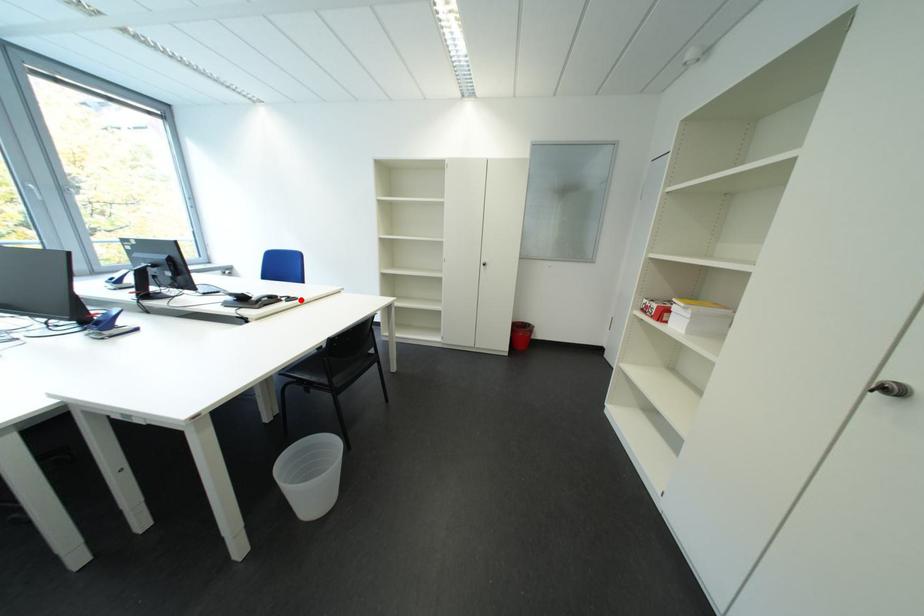
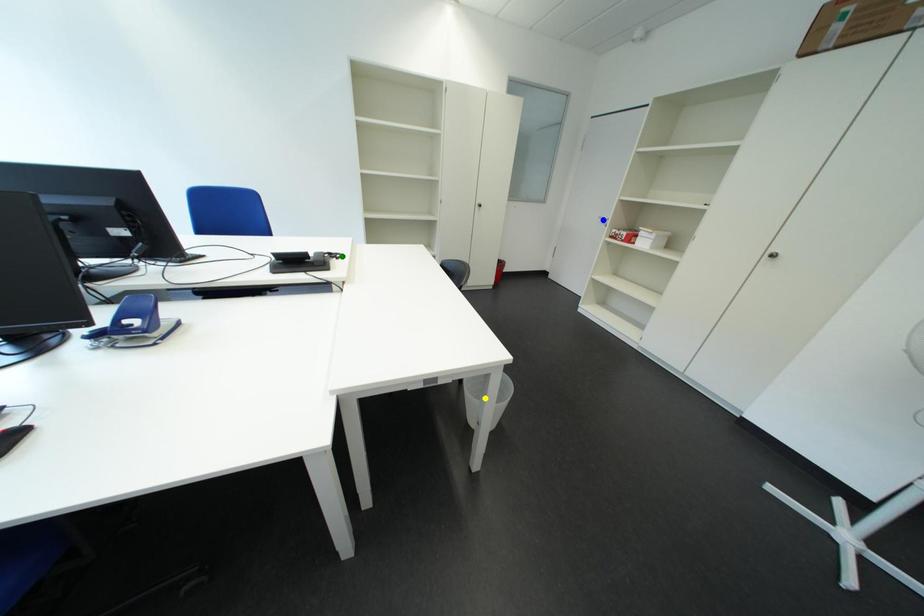
Question: I am providing you with two images of the same scene from different viewpoints. A red point is marked on the first image. You are given multiple points on the second image. Which mark in image 2 goes with the point in image 1?

Choices:
 (A) blue point
 (B) yellow point
 (C) green point

Answer: (C)